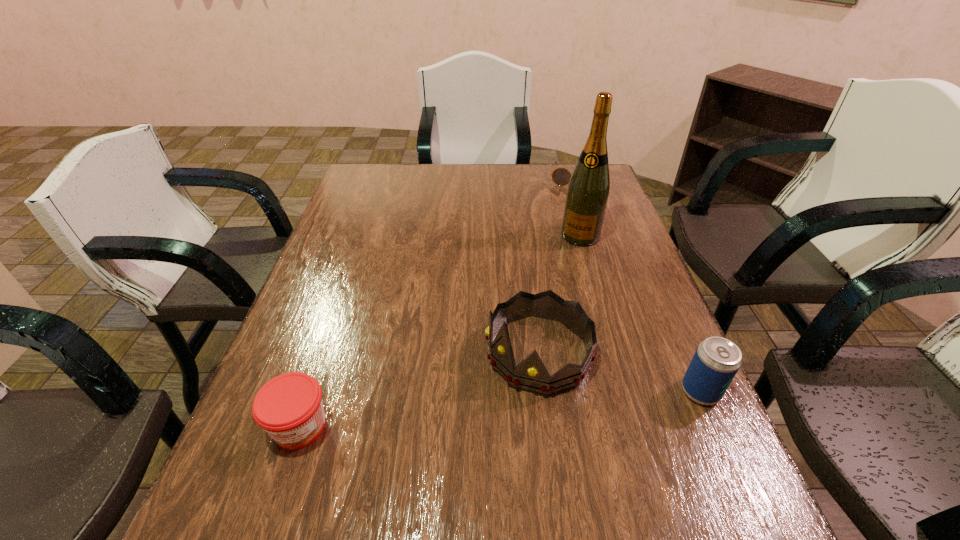
Select which object appears as the third closest to the fourth nearest object. Please provide its 2D coordinates. Your answer should be formatted as a tuple, i.e. [(x, y)], where the tuple contains the x and y coordinates of a point satisfying the conditions above.

[(716, 361)]

Locate an element on the screen. Image resolution: width=960 pixels, height=540 pixels. vacant space that satisfies the following two spatial constraints: 1. on the front side of the third tallest object; 2. on the right side of the second tallest object is located at coordinates (543, 392).